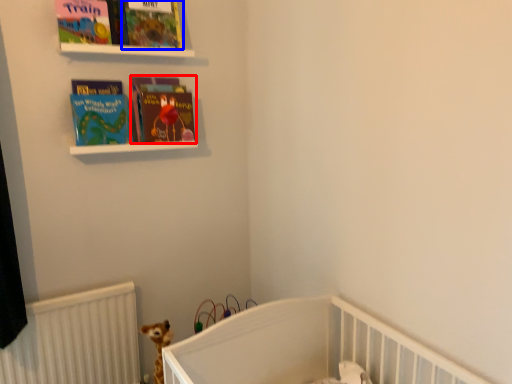
Question: Among these objects, which one is farthest to the camera, book (highlighted by a red box) or book cover (highlighted by a blue box)?

Choices:
 (A) book
 (B) book cover

Answer: (A)